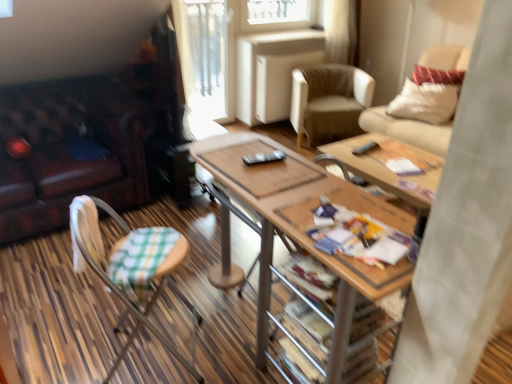
Where is `free space to the left of woodenmaterial/texturetable at center`? The width and height of the screenshot is (512, 384). free space to the left of woodenmaterial/texturetable at center is located at coordinates (136, 324).